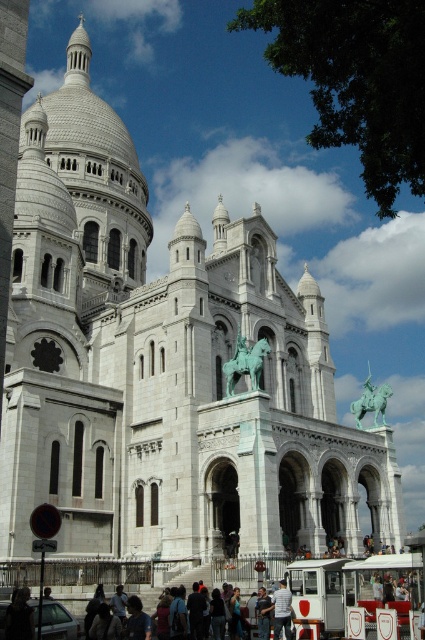
Is point (30, 634) positioned before point (260, 612)?

Yes, point (30, 634) is in front of point (260, 612).

Is dark brown leather jacket at lower left positioned at the back of white cotton shirt at center?

No, dark brown leather jacket at lower left is in front of white cotton shirt at center.

Who is more distant from viewer, [31,624] or [280,624]?

The point [280,624] is behind.

The width and height of the screenshot is (425, 640). What are the coordinates of `dark brown leather jacket at lower left` in the screenshot? It's located at (19, 616).

Consider the image. Is green patina statue at center above dark blue shirt at lower center?

Correct, green patina statue at center is located above dark blue shirt at lower center.

Is green patina statue at center wider than dark blue shirt at lower center?

Correct, the width of green patina statue at center exceeds that of dark blue shirt at lower center.

Locate an element on the screen. green patina statue at center is located at coordinates (246, 362).

Does dark brown leather jacket at lower left have a greater height compared to dark blue shirt at lower center?

Yes, dark brown leather jacket at lower left is taller than dark blue shirt at lower center.

Who is more forward, (16, 611) or (139, 604)?

Point (16, 611)

Locate an element on the screen. Image resolution: width=425 pixels, height=640 pixels. dark brown leather jacket at lower left is located at coordinates (19, 616).